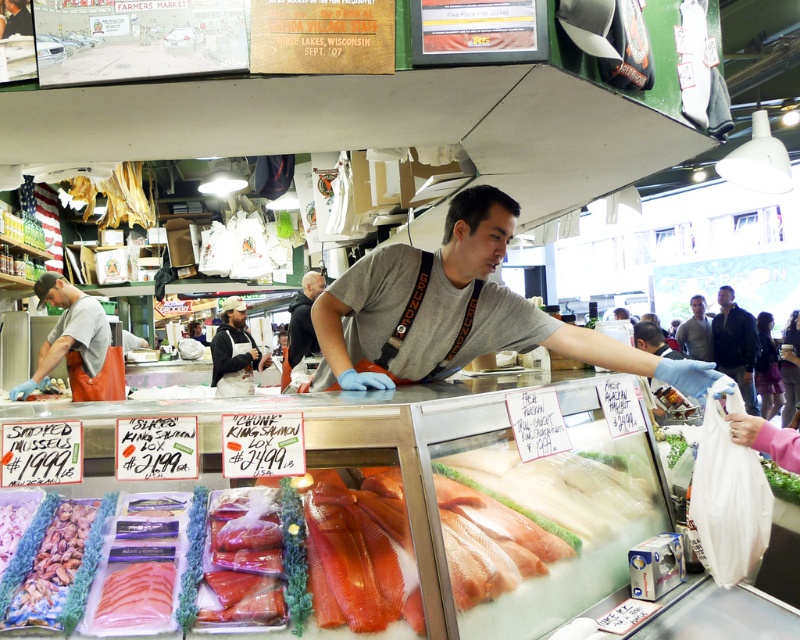
You are a customer at the fish market holding a smooth plastic bag at lower right. You want to put some shiny brown mussels at lower left into the bag. Can the bag hold all the mussels if you fill it to the brim?

The shiny brown mussels at lower left occupies less space than smooth plastic bag at lower right, so yes, the bag can hold all the mussels if filled to the brim since the mussels take up less space than the bag.

You are a customer at Pike Place Fish Market holding a smooth plastic bag at lower right. You want to place the shiny brown mussels at lower left into the bag. Can you fit the mussels into the bag based on their height?

The shiny brown mussels at lower left are shorter than the smooth plastic bag at lower right, so the mussels can fit inside the bag vertically.